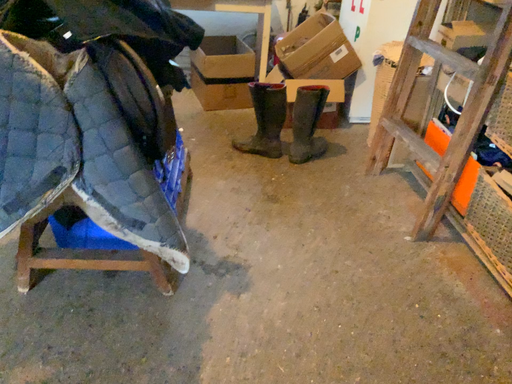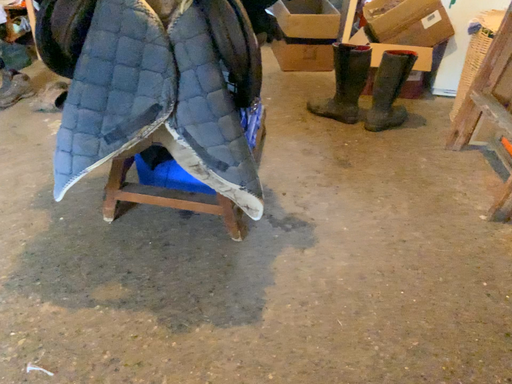
Question: Which way did the camera rotate in the video?

Choices:
 (A) rotated right
 (B) rotated left

Answer: (B)